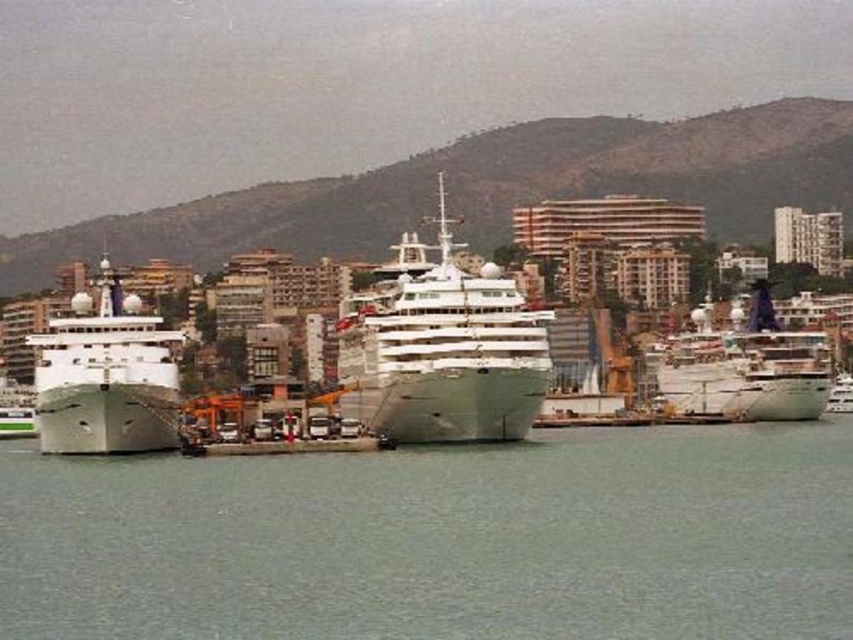
Question: Is green water at center to the right of white glossy cruise ship at center from the viewer's perspective?

Choices:
 (A) yes
 (B) no

Answer: (A)

Question: Which is farther from the green water at center?

Choices:
 (A) green matte ship at left
 (B) white glossy ship at right

Answer: (B)

Question: Which object appears farthest from the camera in this image?

Choices:
 (A) white glossy cruise ship at center
 (B) green matte ship at left

Answer: (A)

Question: Which point is closer to the camera?

Choices:
 (A) green matte ship at left
 (B) white glossy ship at right
 (C) white glossy cruise ship at center
 (D) green water at center

Answer: (D)

Question: Can you confirm if white glossy cruise ship at center is positioned above green matte ship at left?

Choices:
 (A) no
 (B) yes

Answer: (B)

Question: Can you confirm if green water at center is smaller than green matte ship at left?

Choices:
 (A) yes
 (B) no

Answer: (A)